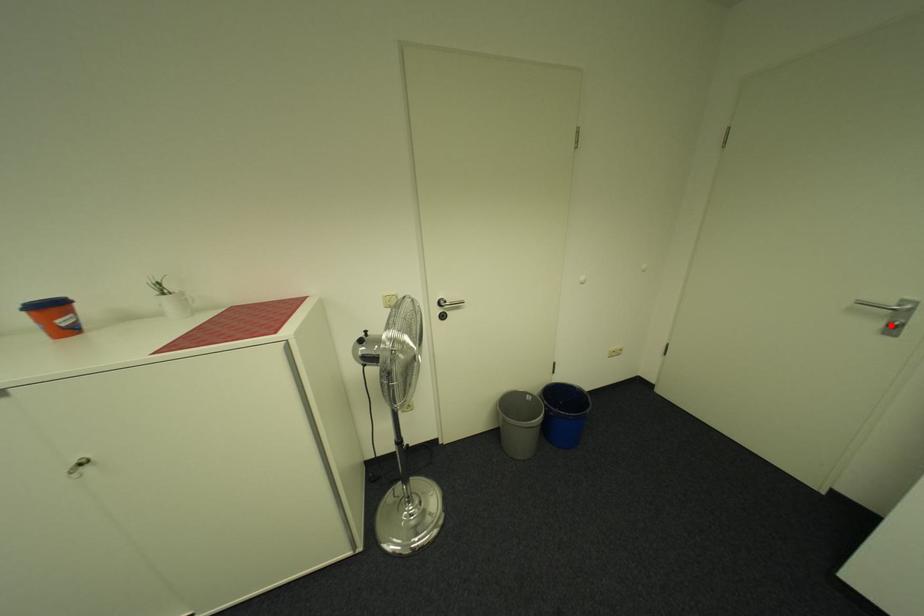
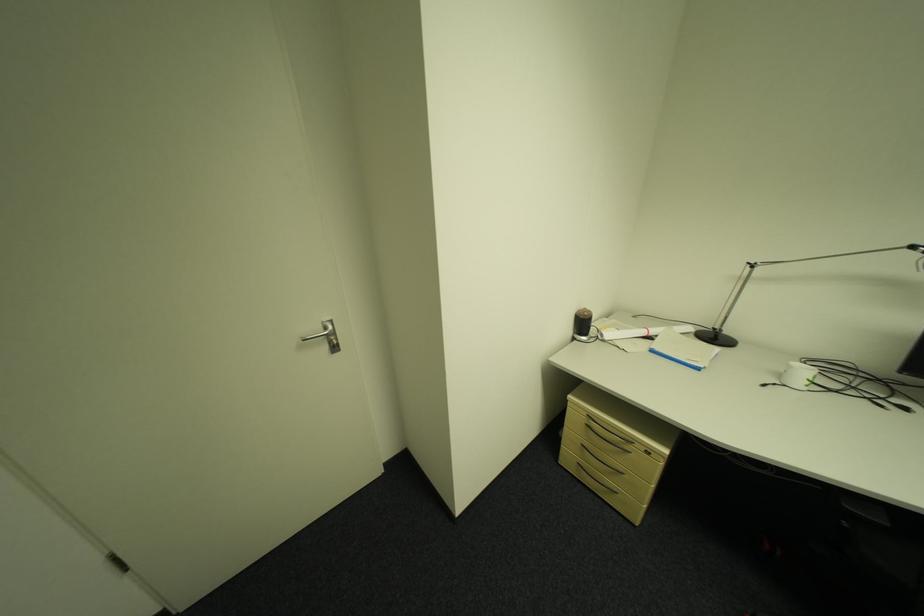
Where in the second image is the point corresponding to the highlighted location from the first image?

(335, 349)